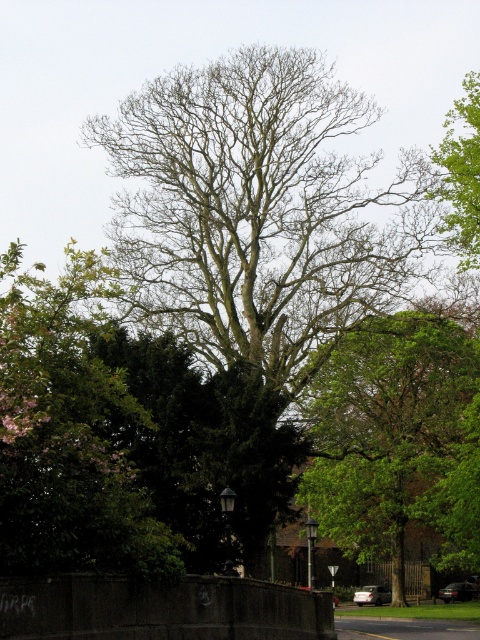
Question: Is bare branches at center further to camera compared to green leafy tree at center?

Choices:
 (A) no
 (B) yes

Answer: (A)

Question: Can you confirm if bare branches at center is thinner than green leafy tree at center?

Choices:
 (A) no
 (B) yes

Answer: (A)

Question: Which point appears closest to the camera in this image?

Choices:
 (A) (266, 204)
 (B) (333, 394)
 (C) (469, 161)

Answer: (C)

Question: Which object is closer to the camera taking this photo?

Choices:
 (A) bare branches at center
 (B) green leafy tree at center

Answer: (A)

Question: Which of the following is the closest to the observer?

Choices:
 (A) (115, 253)
 (B) (372, 492)
 (C) (470, 230)

Answer: (C)

Question: Is green leafy tree at center above green leafy tree at upper right?

Choices:
 (A) yes
 (B) no

Answer: (B)